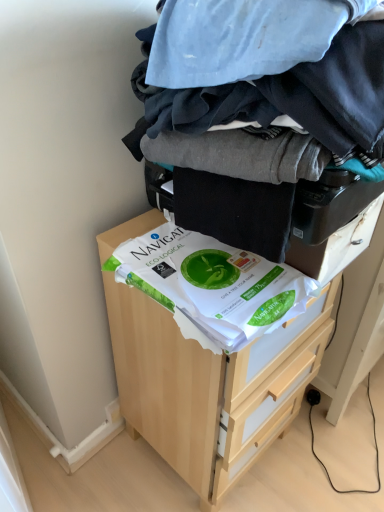
Question: Considering their positions, is light wood chest of drawers at center located in front of or behind white paper at center?

Choices:
 (A) behind
 (B) front

Answer: (A)

Question: Does point (139, 406) appear closer or farther from the camera than point (278, 303)?

Choices:
 (A) farther
 (B) closer

Answer: (A)

Question: Which object is positioned farthest from the white paper at center?

Choices:
 (A) light wood chest of drawers at center
 (B) dark blue cotton laundry at center

Answer: (A)

Question: Estimate the real-world distances between objects in this image. Which object is closer to the dark blue cotton laundry at center?

Choices:
 (A) white paper at center
 (B) light wood chest of drawers at center

Answer: (A)